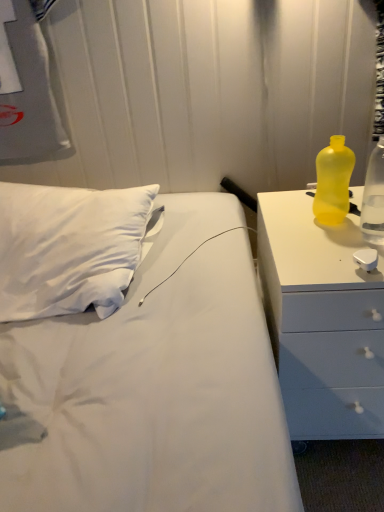
What are the coordinates of `vacant region to the left of yellow translucent bottle at right, the first bottle positioned from the right` in the screenshot? It's located at (315, 237).